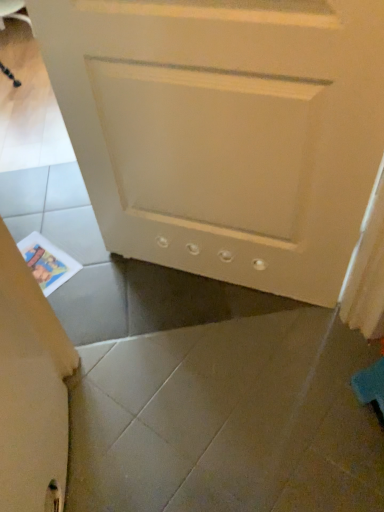
Question: Is white matte door at center taller or shorter than printed paper at lower left?

Choices:
 (A) tall
 (B) short

Answer: (A)

Question: Is white matte door at center spatially inside printed paper at lower left, or outside of it?

Choices:
 (A) outside
 (B) inside

Answer: (A)

Question: Would you say white matte door at center is to the left or to the right of printed paper at lower left in the picture?

Choices:
 (A) left
 (B) right

Answer: (B)

Question: Is point (23, 245) closer or farther from the camera than point (274, 41)?

Choices:
 (A) closer
 (B) farther

Answer: (B)

Question: Is printed paper at lower left to the left or to the right of white matte door at center in the image?

Choices:
 (A) left
 (B) right

Answer: (A)

Question: Based on their sizes in the image, would you say printed paper at lower left is bigger or smaller than white matte door at center?

Choices:
 (A) small
 (B) big

Answer: (A)

Question: Relative to white matte door at center, is printed paper at lower left in front or behind?

Choices:
 (A) behind
 (B) front

Answer: (A)